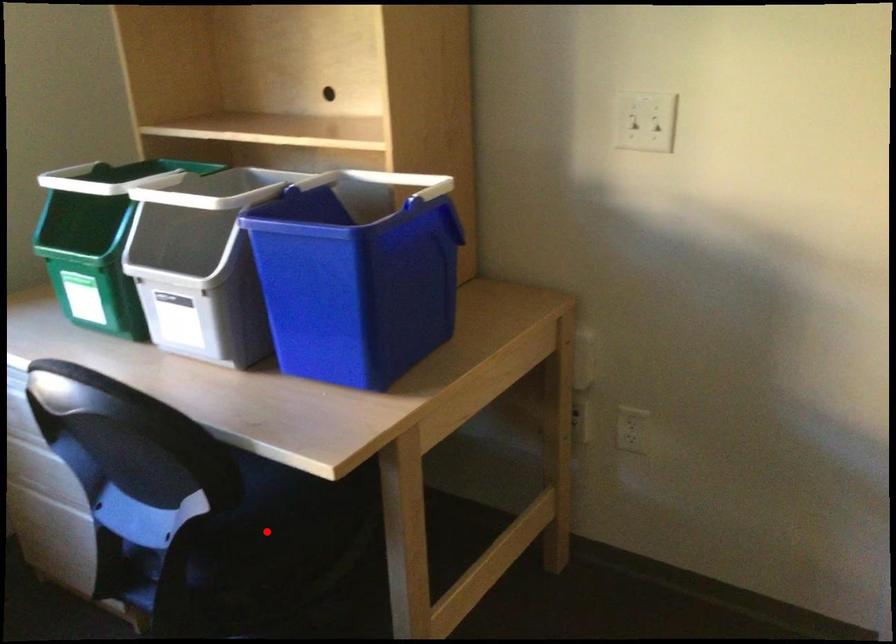
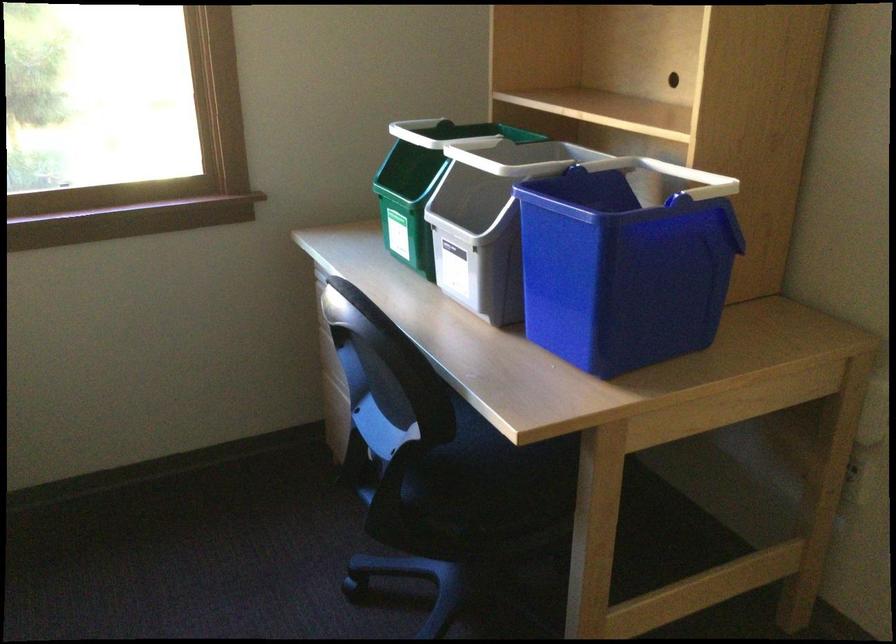
Where in the second image is the point corresponding to the highlighted location from the first image?

(479, 476)